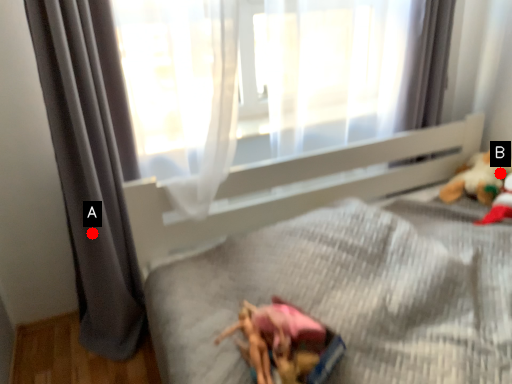
Question: Two points are circled on the image, labeled by A and B beside each circle. Which of the following is the farthest from the observer?

Choices:
 (A) A is further
 (B) B is further

Answer: (B)